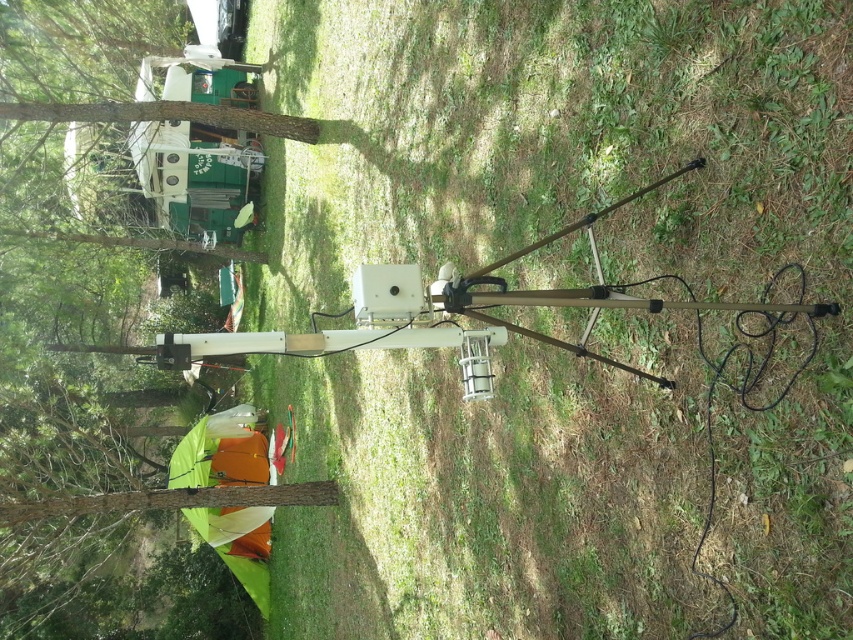
Question: Among these objects, which one is farthest from the camera?

Choices:
 (A) brown wood tree at left
 (B) green grass at center

Answer: (A)

Question: Is green grass at center wider than brown wood tree at left?

Choices:
 (A) no
 (B) yes

Answer: (A)

Question: Is green grass at center above brown wood tree at left?

Choices:
 (A) no
 (B) yes

Answer: (A)

Question: From the image, what is the correct spatial relationship of green grass at center in relation to brown wood tree at left?

Choices:
 (A) above
 (B) below

Answer: (B)

Question: Which object appears farthest from the camera in this image?

Choices:
 (A) green grass at center
 (B) brown wood tree at left

Answer: (B)

Question: Which object is closer to the camera taking this photo?

Choices:
 (A) green grass at center
 (B) brown wood tree at left

Answer: (A)